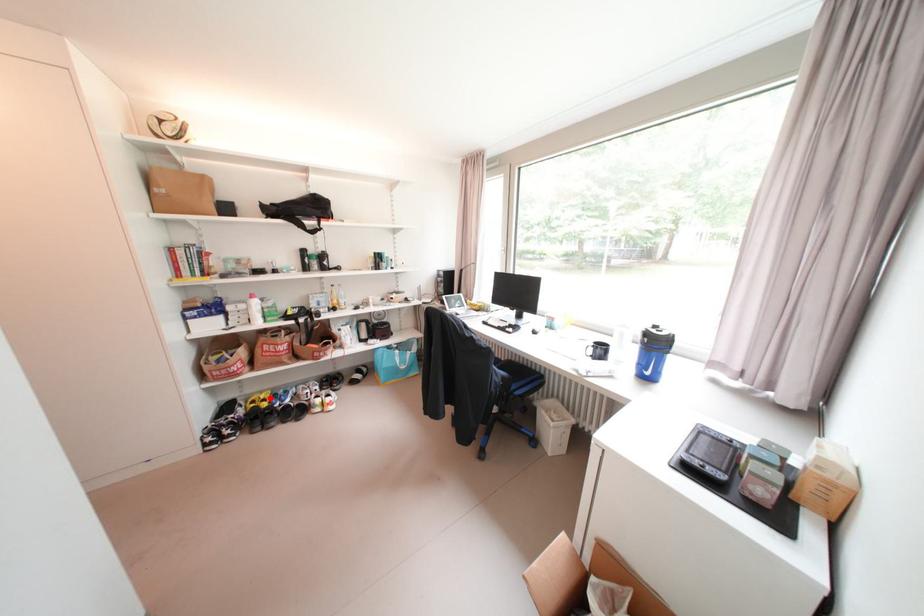
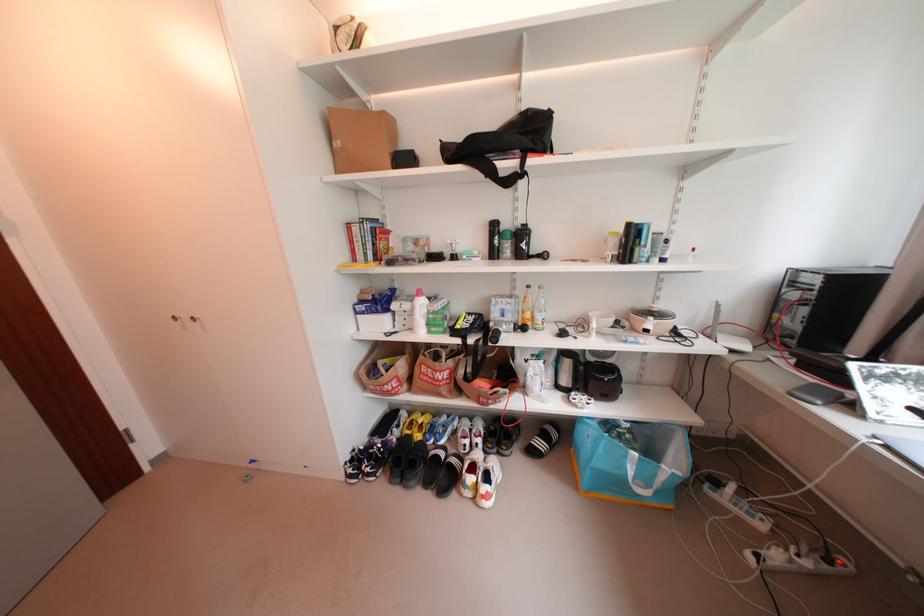
Locate, in the second image, the point that corresponds to the highlighted location in the first image.

(429, 422)